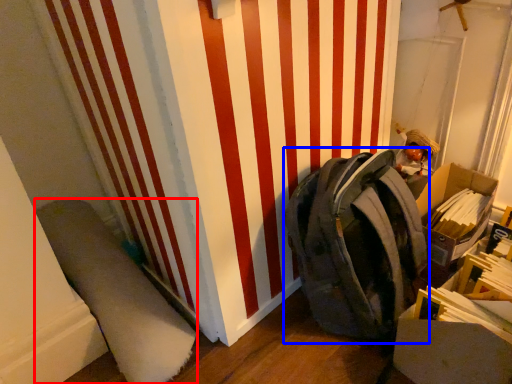
Question: Which object appears farthest to the camera in this image, wide (highlighted by a red box) or backpack (highlighted by a blue box)?

Choices:
 (A) wide
 (B) backpack

Answer: (A)